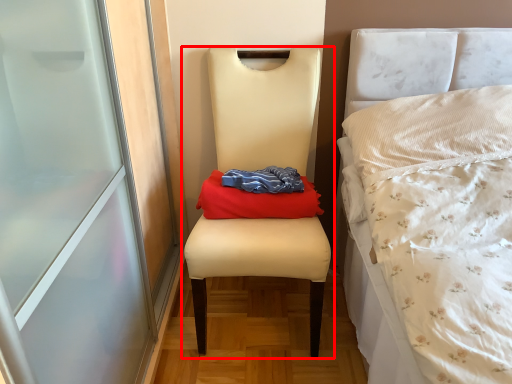
Question: From the image's perspective, where is chair (annotated by the red box) located relative to material?

Choices:
 (A) below
 (B) above

Answer: (A)